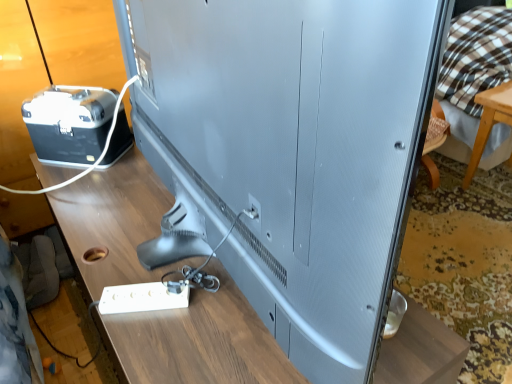
Question: Is point (142, 291) closer or farther from the camera than point (196, 297)?

Choices:
 (A) closer
 (B) farther

Answer: (B)

Question: In terms of height, does white plastic extension cord at lower left look taller or shorter compared to wooden table at center?

Choices:
 (A) short
 (B) tall

Answer: (A)

Question: Which of these objects is positioned closest to the white plastic wire at left?

Choices:
 (A) white plastic extension cord at lower left
 (B) brown checkered fabric at upper right
 (C) wooden table at center

Answer: (C)

Question: Based on their relative distances, which object is farther from the wooden table at center?

Choices:
 (A) white plastic wire at left
 (B) white plastic extension cord at lower left
 (C) brown checkered fabric at upper right

Answer: (C)